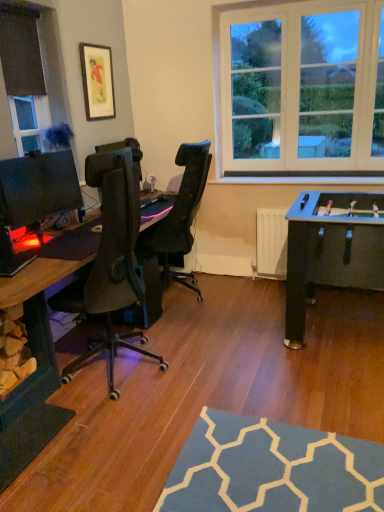
Question: From the image's perspective, is matte gold picture frame at upper left located above or below black fabric at upper left?

Choices:
 (A) above
 (B) below

Answer: (A)

Question: From a real-world perspective, is matte gold picture frame at upper left physically located above or below black fabric at upper left?

Choices:
 (A) above
 (B) below

Answer: (B)

Question: Which is farther from the black fabric at upper left?

Choices:
 (A) matte black desk at left
 (B) matte black monitor at left
 (C) matte gold picture frame at upper left

Answer: (A)

Question: Considering the real-world distances, which object is closest to the matte black desk at left?

Choices:
 (A) matte black monitor at left
 (B) black fabric at upper left
 (C) matte gold picture frame at upper left

Answer: (A)